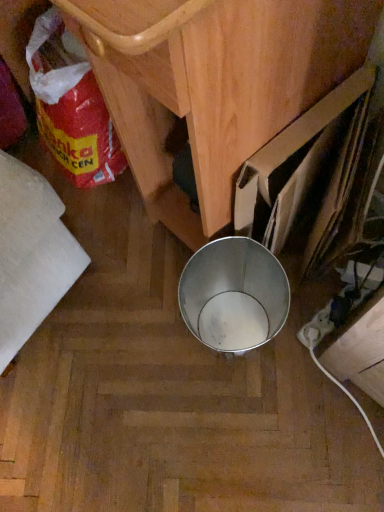
Question: From the image's perspective, relative to red plastic bag at lower left, is metallic bucket at center above or below?

Choices:
 (A) below
 (B) above

Answer: (B)

Question: In terms of width, does metallic bucket at center look wider or thinner when compared to red plastic bag at lower left?

Choices:
 (A) wide
 (B) thin

Answer: (A)

Question: Considering the positions of metallic bucket at center and red plastic bag at lower left in the image, is metallic bucket at center bigger or smaller than red plastic bag at lower left?

Choices:
 (A) small
 (B) big

Answer: (B)

Question: From a real-world perspective, is red plastic bag at lower left above or below metallic bucket at center?

Choices:
 (A) above
 (B) below

Answer: (B)

Question: Is point (79, 78) closer or farther from the camera than point (223, 198)?

Choices:
 (A) farther
 (B) closer

Answer: (A)

Question: From the image's perspective, relative to metallic bucket at center, is red plastic bag at lower left above or below?

Choices:
 (A) above
 (B) below

Answer: (B)

Question: Is red plastic bag at lower left to the left or to the right of metallic bucket at center in the image?

Choices:
 (A) left
 (B) right

Answer: (A)